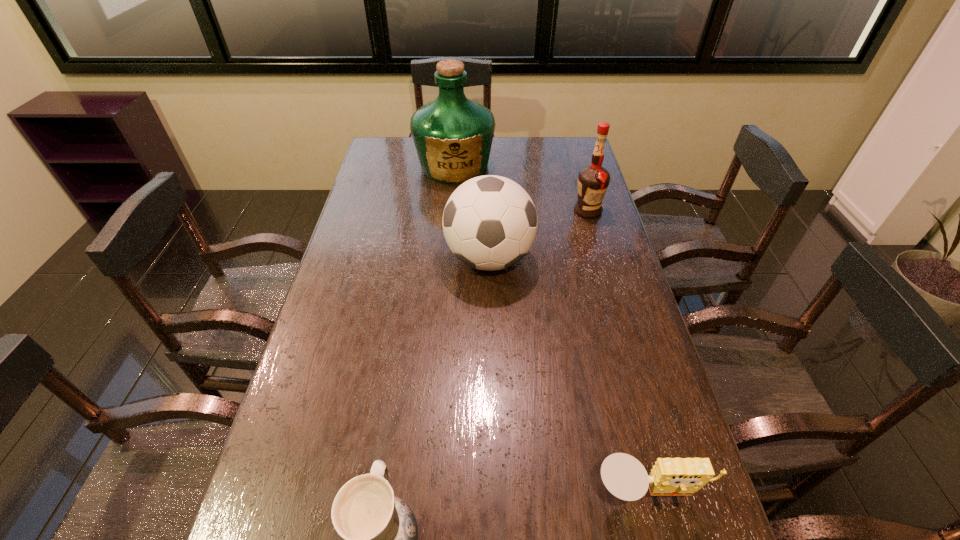
The height and width of the screenshot is (540, 960). I want to click on the taller liquor, so click(453, 135).

I want to click on the left liquor, so click(453, 135).

Find the location of a particular element. the right liquor is located at coordinates (593, 180).

Find the location of a particular element. Image resolution: width=960 pixels, height=540 pixels. the fourth nearest object is located at coordinates (593, 180).

Find the location of `the third shortest object`. the third shortest object is located at coordinates coord(489,222).

Where is `the third farthest object`? The height and width of the screenshot is (540, 960). the third farthest object is located at coordinates (489, 222).

Where is `sponge`? sponge is located at coordinates (624, 476).

Locate an element on the screen. free spot located 0.180m on the label side of the farther liquor is located at coordinates (451, 218).

This screenshot has height=540, width=960. I want to click on free spot located 0.160m on the front and back of the second tallest object, so click(x=599, y=251).

In order to click on vacant space situated on the right of the third farthest object in this screenshot , I will do `click(612, 259)`.